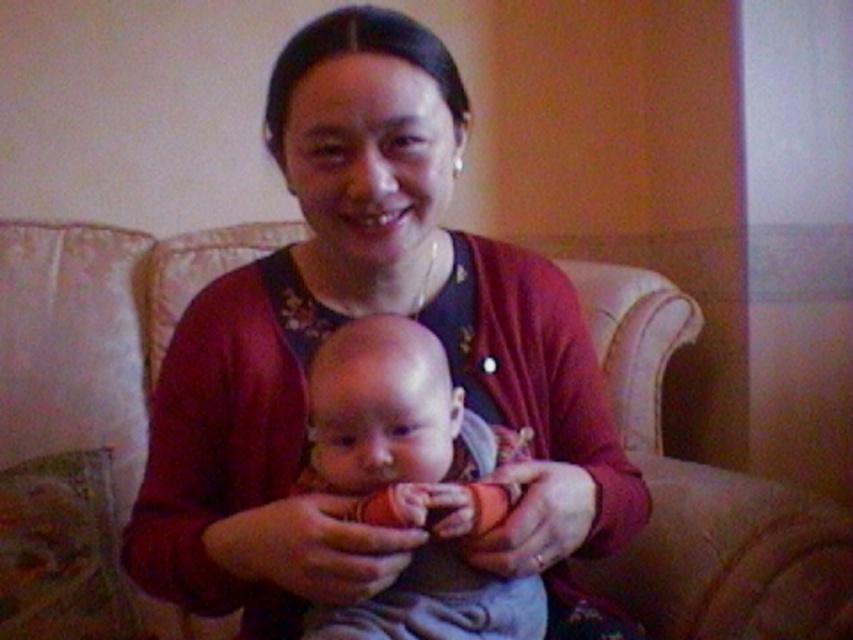
Who is higher up, beige fabric couch at center or smooth skin baby at center?

beige fabric couch at center is above.

Does point (148, 246) come farther from viewer compared to point (476, 426)?

Yes, point (148, 246) is farther from viewer.

Does point (88, 298) come farther from viewer compared to point (379, 630)?

Yes, point (88, 298) is farther from viewer.

Where is `beige fabric couch at center`? This screenshot has height=640, width=853. beige fabric couch at center is located at coordinates (706, 499).

Is the position of matte red cardigan at center more distant than that of beige fabric couch at center?

No.

Is matte red cardigan at center thinner than beige fabric couch at center?

No, matte red cardigan at center is not thinner than beige fabric couch at center.

Identify the location of matte red cardigan at center. (350, 317).

Does matte red cardigan at center have a larger size compared to smooth skin baby at center?

Yes, matte red cardigan at center is bigger than smooth skin baby at center.

Is point (154, 538) positioned before point (335, 636)?

No, (154, 538) is behind (335, 636).

Find the location of a particular element. Image resolution: width=853 pixels, height=640 pixels. matte red cardigan at center is located at coordinates (350, 317).